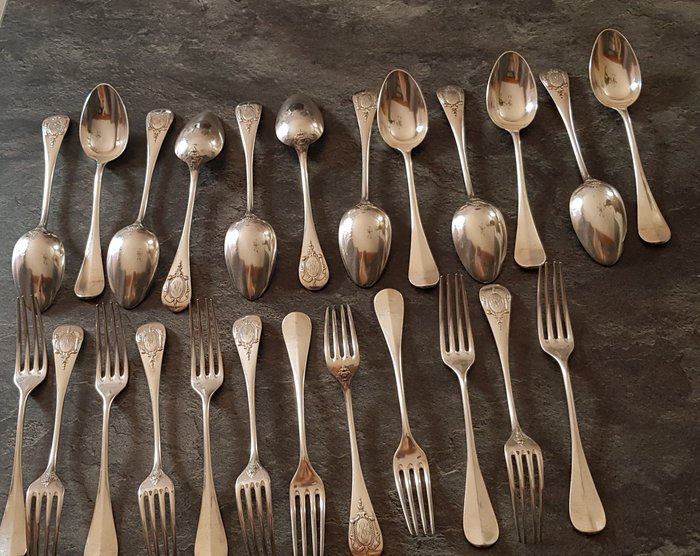
At what (x,y) coordinates should I click in order to perform the action: click on spoons pointing down. Please return your answer as a coordinate pair (x, y). Image resolution: width=700 pixels, height=556 pixels. Looking at the image, I should click on (50, 242), (126, 246), (244, 247), (351, 240), (472, 230), (589, 217).